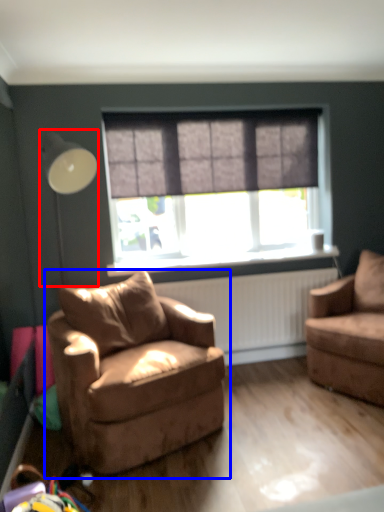
Question: Among these objects, which one is farthest to the camera, table lamp (highlighted by a red box) or chair (highlighted by a blue box)?

Choices:
 (A) table lamp
 (B) chair

Answer: (A)